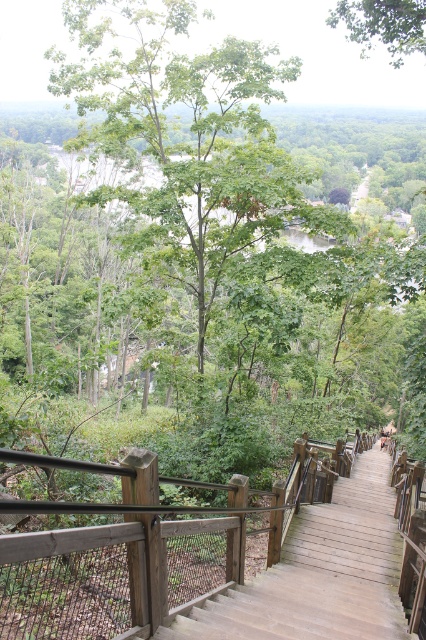
You are planning to take a photo of the wooden stairs at center and the green leafy tree at upper center. Which object appears smaller in the photo?

The wooden stairs at center appears smaller in the photo because it has a smaller size compared to the green leafy tree at upper center.

In the scene shown: You are standing at the top of the wooden staircase in the forest. You notice two points marked in the scene. From your perspective, which point is closer to you, point (x=229, y=202) or point (x=333, y=20)?

Point (x=333, y=20) is closer to you because point (x=229, y=202) is behind it.